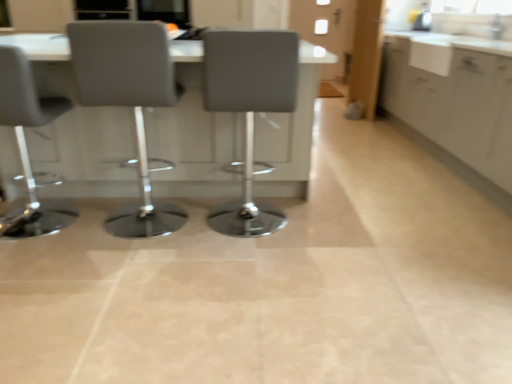
Question: Is white matte cabinet at right in front of or behind matte gray chair at left, which appears as the third chair when viewed from the right, in the image?

Choices:
 (A) front
 (B) behind

Answer: (B)

Question: Looking at the image, does white matte cabinet at right seem bigger or smaller compared to matte gray chair at left, the 1th chair viewed from the left?

Choices:
 (A) small
 (B) big

Answer: (B)

Question: Which object is the closest to the matte gray chair at center, which appears as the 2th chair when viewed from the right?

Choices:
 (A) white glossy table at center
 (B) matte gray chair at left, the 1th chair viewed from the left
 (C) matte black screen at upper center
 (D) matte gray chair at center, which ranks as the 1th chair in right-to-left order
 (E) white matte cabinet at right

Answer: (D)

Question: Which object is the farthest from the white glossy countertop at upper right?

Choices:
 (A) matte gray chair at center, positioned as the third chair in left-to-right order
 (B) matte black screen at upper center
 (C) matte gray chair at left, the 1th chair viewed from the left
 (D) matte gray chair at center, acting as the 2th chair starting from the left
 (E) white glossy table at center

Answer: (C)